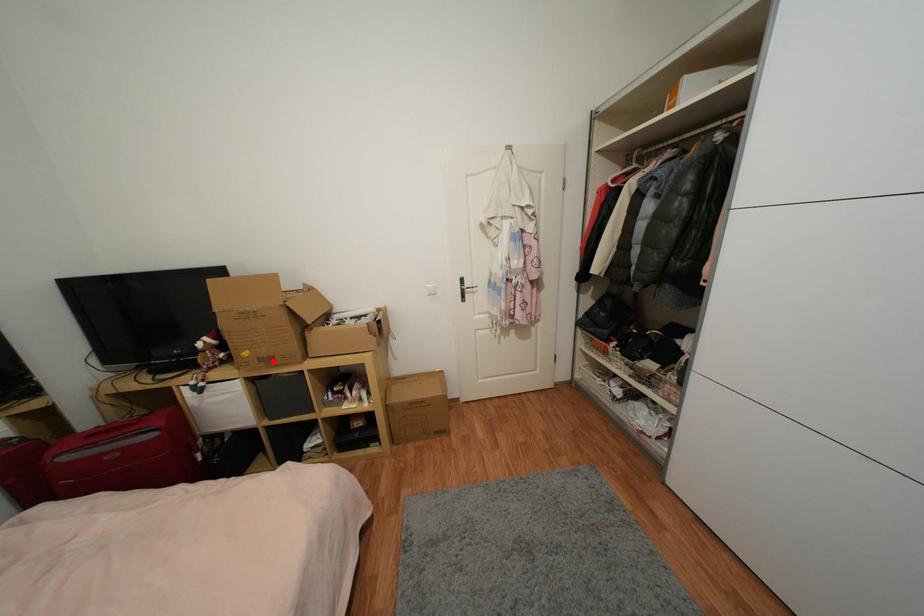
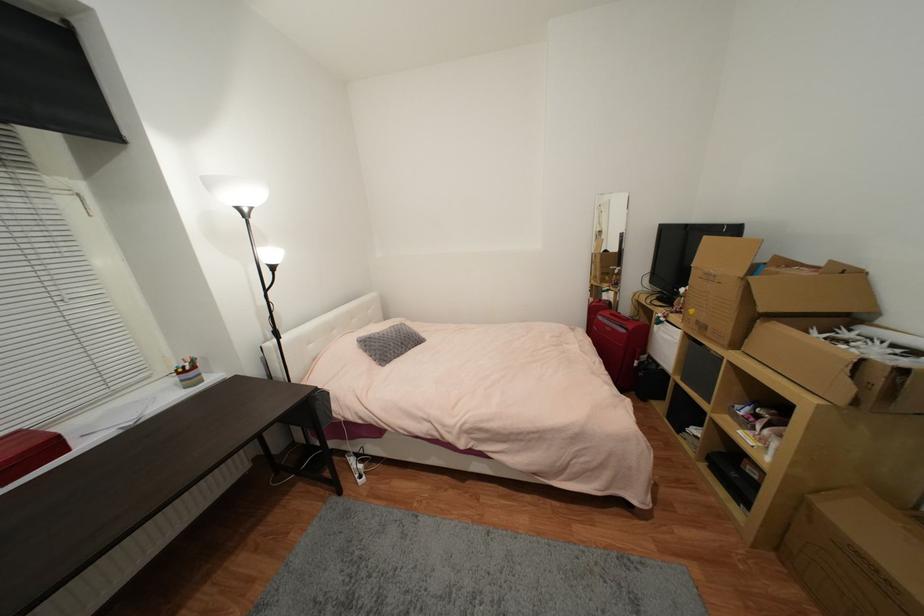
Question: I am providing you with two images of the same scene from different viewpoints. Given a red point in image1, look at the same physical point in image2. Is it:

Choices:
 (A) Closer to the viewpoint
 (B) Farther from the viewpoint

Answer: (A)